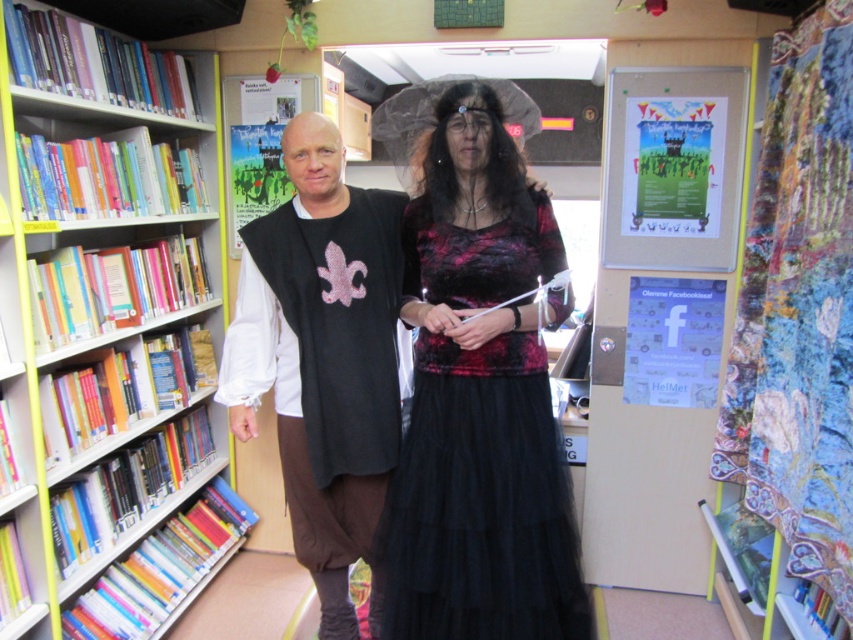
Which is above, velvet black dress at center or velvet-like black dress at center?

velvet black dress at center is above.

Is point (317, 198) positioned before point (524, 355)?

No, it is not.

Is point (393, 486) farther from camera compared to point (558, 531)?

Yes.

In order to click on velvet black dress at center in this screenshot , I will do `click(346, 348)`.

Looking at this image, which is more to the left, multicolored paper bookshelf at left or velvet black dress at center?

From the viewer's perspective, multicolored paper bookshelf at left appears more on the left side.

Who is shorter, multicolored paper bookshelf at left or velvet black dress at center?

Standing shorter between the two is velvet black dress at center.

Which is behind, point (50, 506) or point (263, 262)?

The point (50, 506) is more distant.

Where is `multicolored paper bookshelf at left`? The width and height of the screenshot is (853, 640). multicolored paper bookshelf at left is located at coordinates (105, 310).

Can you confirm if multicolored paper bookshelf at left is thinner than velvet-like black dress at center?

Yes.

Is multicolored paper bookshelf at left further to the viewer compared to velvet-like black dress at center?

Yes, multicolored paper bookshelf at left is further from the viewer.

Between point (219, 330) and point (534, 502), which one is positioned behind?

The point (219, 330) is more distant.

Find the location of `multicolored paper bookshelf at left`. multicolored paper bookshelf at left is located at coordinates (105, 310).